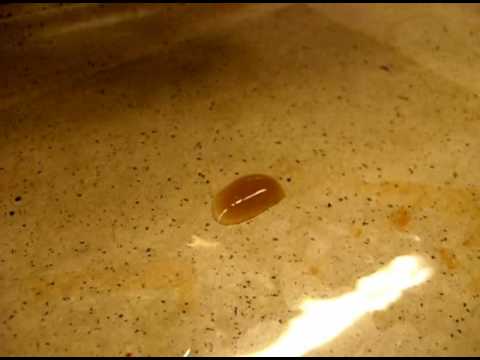
This screenshot has width=480, height=360. I want to click on stains on countertop, so click(x=399, y=216), click(x=440, y=247), click(x=91, y=109).